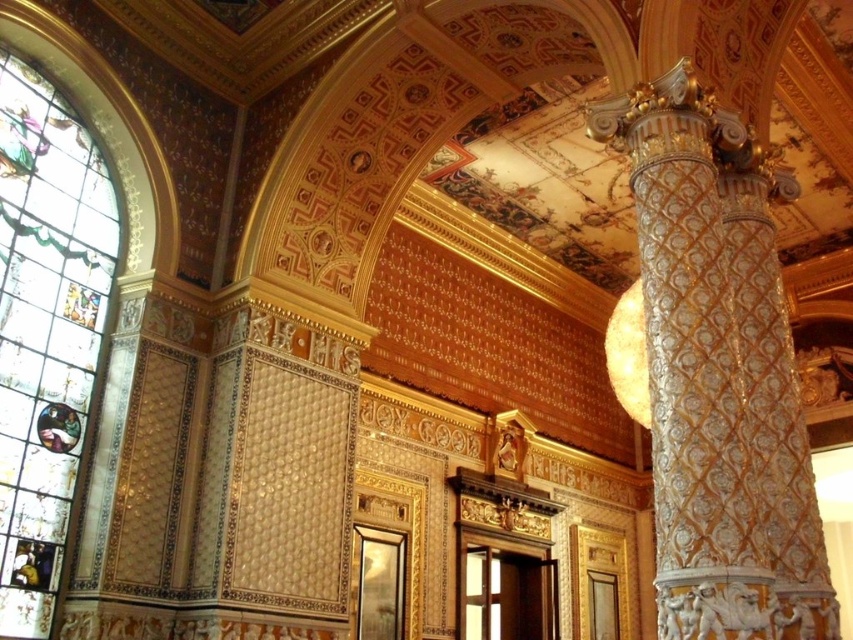
You are standing in the room and want to reach both the point at coordinates (693, 198) and the point at coordinates (28, 417). Which point will you reach first if you move straight ahead?

You will reach the point at coordinates (693, 198) first because it is closer to you than the point at coordinates (28, 417).

You are an interior designer planning to install a new light fixture between the white textured column at right and the stained glass at left. Based on their positions, where should the light fixture be placed?

The white textured column at right is below the stained glass at left, so the light fixture should be placed between them, above the column and below the stained glass.

You are an interior designer planning to install a new light fixture. You have two options. One is a large chandelier that needs to be placed in the center of the room. The other is a modern pendant light that should be positioned near the white textured column at right. Which option would you choose if you want the light to illuminate the stained glass at left more effectively?

The modern pendant light positioned near the white textured column at right would illuminate the stained glass at left more effectively because the stained glass at left is located to the left of the column. Placing the pendant light near the column allows the light to cast towards the stained glass, whereas a central chandelier might spread light more evenly but not specifically target the stained glass area.